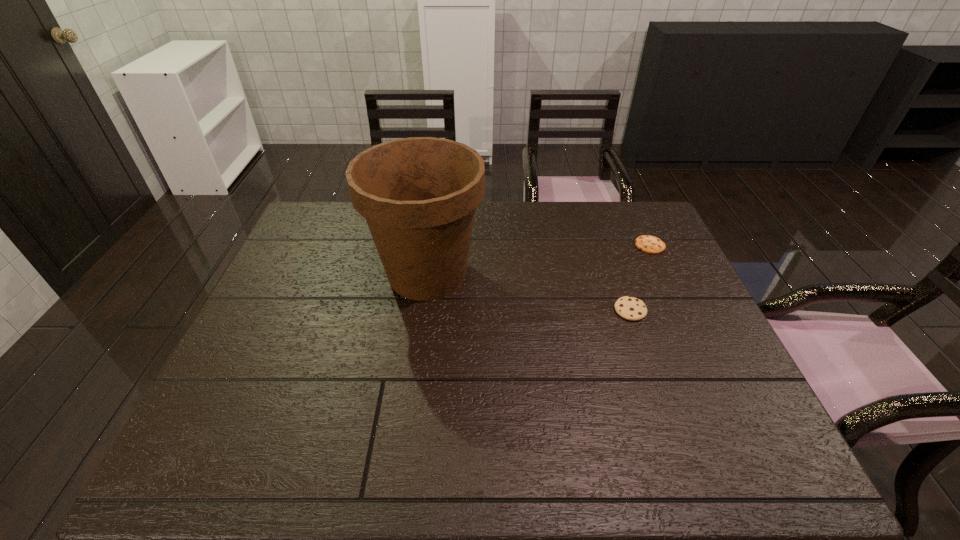
The image size is (960, 540). Identify the location of cookie positioned at the far edge. (649, 244).

Identify the location of object that is at the far right corner. (649, 244).

In the image, there is a desktop. At what (x,y) coordinates should I click in order to perform the action: click on vacant region at the far edge. Please return your answer as a coordinate pair (x, y). Looking at the image, I should click on (511, 240).

Locate an element on the screen. vacant space at the left edge of the desktop is located at coordinates (266, 316).

In the image, there is a desktop. What are the coordinates of `vacant space at the right edge` in the screenshot? It's located at (653, 271).

You are a GUI agent. You are given a task and a screenshot of the screen. Output one action in this format:
    pyautogui.click(x=<x>, y=<y>)
    Task: Click on the free region at the far left corner
    This screenshot has width=960, height=540.
    Given the screenshot: What is the action you would take?
    [x=346, y=226]

In the image, there is a desktop. At what (x,y) coordinates should I click in order to perform the action: click on free space at the far right corner. Please return your answer as a coordinate pair (x, y). Looking at the image, I should click on (617, 205).

I want to click on vacant space that's between the second shortest object and the flowerpot, so click(529, 292).

At what (x,y) coordinates should I click in order to perform the action: click on free space between the second object from left to right and the farther cookie. Please return your answer as a coordinate pair (x, y). The height and width of the screenshot is (540, 960). Looking at the image, I should click on (640, 278).

Locate an element on the screen. The image size is (960, 540). unoccupied area between the farther cookie and the tallest object is located at coordinates (539, 260).